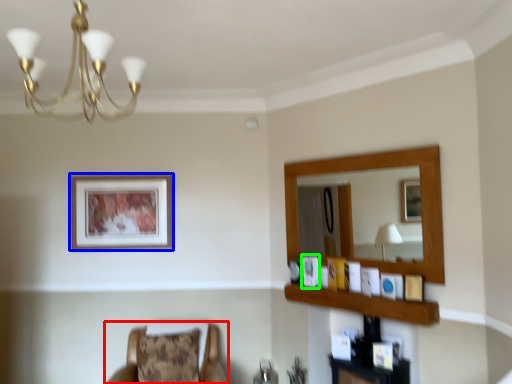
Question: Based on their relative distances, which object is farther from chair (highlighted by a red box)? Choose from picture frame (highlighted by a blue box) and picture frame (highlighted by a green box).

Choices:
 (A) picture frame
 (B) picture frame

Answer: (B)